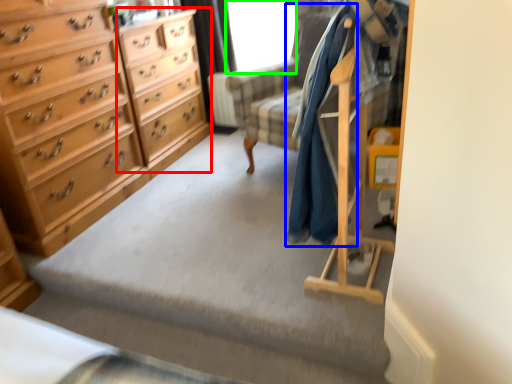
Question: Which is farther away from file cabinet (highlighted by a red box)? clothing (highlighted by a blue box) or window screen (highlighted by a green box)?

Choices:
 (A) clothing
 (B) window screen

Answer: (A)